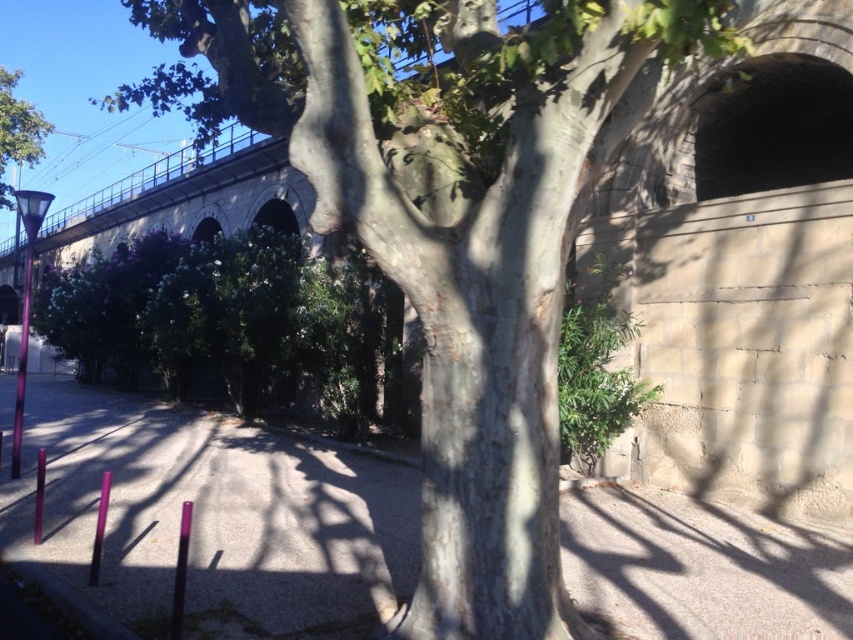
Question: Is dark concrete tunnel at upper right positioned at the back of green leafy tree at upper left?

Choices:
 (A) no
 (B) yes

Answer: (A)

Question: Observing the image, what is the correct spatial positioning of dark concrete tunnel at upper right in reference to green leafy tree at upper left?

Choices:
 (A) left
 (B) right

Answer: (B)

Question: Does dark concrete tunnel at upper right appear on the right side of green leafy tree at upper left?

Choices:
 (A) no
 (B) yes

Answer: (B)